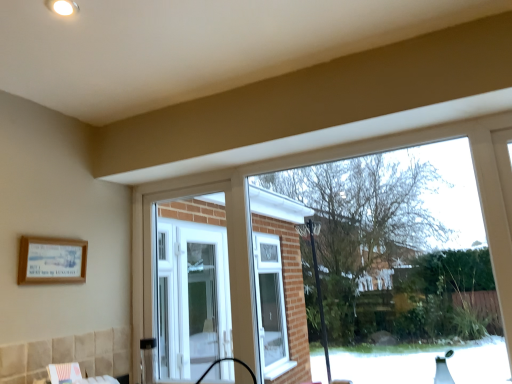
Question: Is white plastic window at center at the right side of wooden framed poster at lower left?

Choices:
 (A) yes
 (B) no

Answer: (A)

Question: Can you confirm if white plastic window at center is thinner than wooden framed poster at lower left?

Choices:
 (A) yes
 (B) no

Answer: (B)

Question: From the image's perspective, is white plastic window at center beneath wooden framed poster at lower left?

Choices:
 (A) no
 (B) yes

Answer: (B)

Question: Are white plastic window at center and wooden framed poster at lower left located far from each other?

Choices:
 (A) no
 (B) yes

Answer: (B)

Question: Is white plastic window at center in contact with wooden framed poster at lower left?

Choices:
 (A) yes
 (B) no

Answer: (B)

Question: Could you tell me if white plastic window at center is facing wooden framed poster at lower left?

Choices:
 (A) yes
 (B) no

Answer: (B)

Question: Is wooden framed poster at lower left taller than white plastic window at center?

Choices:
 (A) yes
 (B) no

Answer: (B)

Question: Considering the relative sizes of wooden framed poster at lower left and white plastic window at center in the image provided, is wooden framed poster at lower left thinner than white plastic window at center?

Choices:
 (A) yes
 (B) no

Answer: (A)

Question: Considering the relative positions of wooden framed poster at lower left and white plastic window at center in the image provided, is wooden framed poster at lower left behind white plastic window at center?

Choices:
 (A) yes
 (B) no

Answer: (B)

Question: Is wooden framed poster at lower left next to white plastic window at center and touching it?

Choices:
 (A) yes
 (B) no

Answer: (B)

Question: Is wooden framed poster at lower left turned away from white plastic window at center?

Choices:
 (A) yes
 (B) no

Answer: (B)

Question: From the image's perspective, would you say wooden framed poster at lower left is shown under white plastic window at center?

Choices:
 (A) yes
 (B) no

Answer: (B)

Question: From a real-world perspective, relative to white plastic window at center, is wooden framed poster at lower left vertically above or below?

Choices:
 (A) above
 (B) below

Answer: (A)